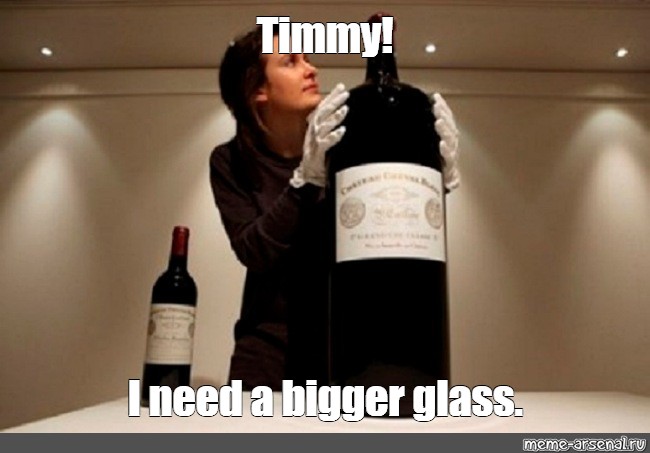
Where is `wall`? The image size is (650, 453). wall is located at coordinates click(106, 247).